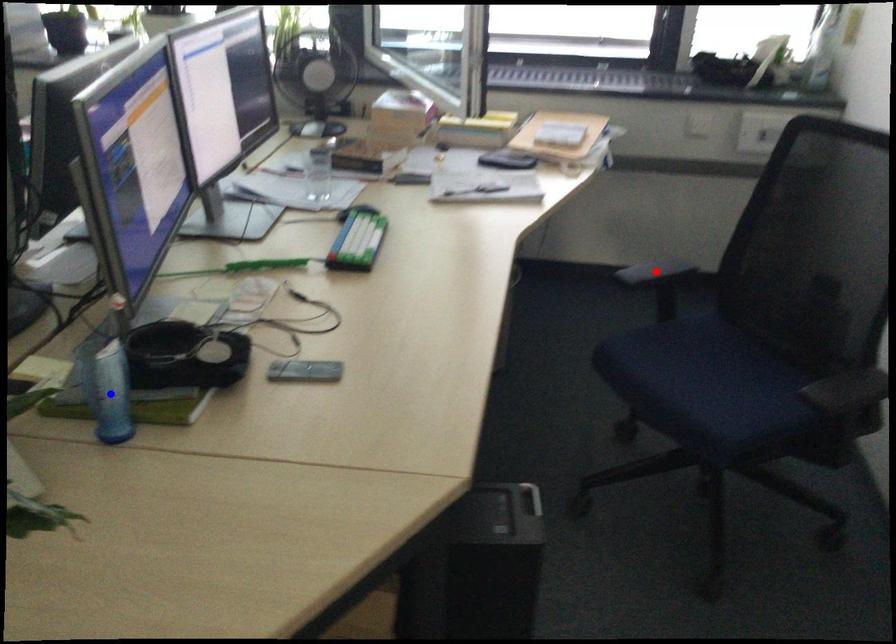
Question: Which of the two points in the image is closer to the camera?

Choices:
 (A) Blue point is closer.
 (B) Red point is closer.

Answer: (A)